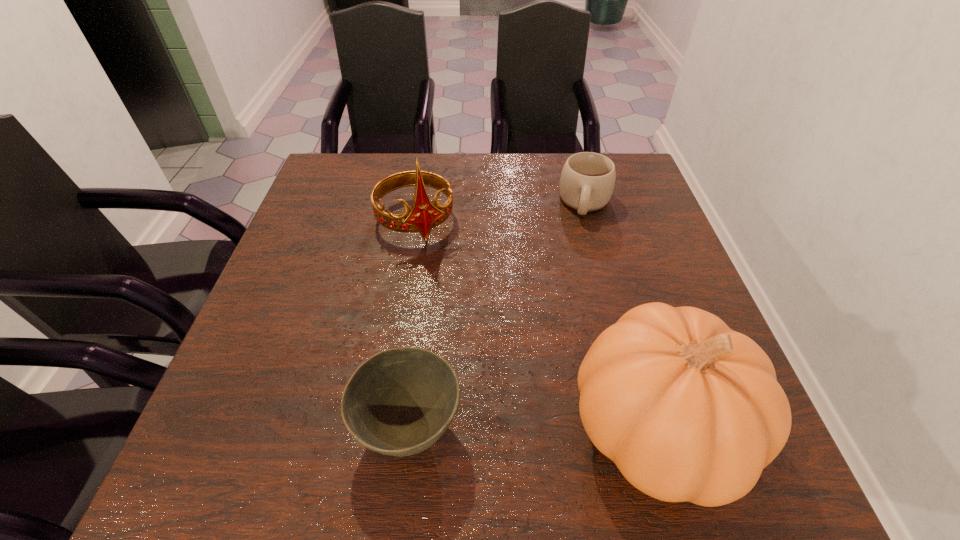
In the image, there is a desktop. Where is `vacant space at the far edge`? The image size is (960, 540). vacant space at the far edge is located at coordinates (487, 163).

Image resolution: width=960 pixels, height=540 pixels. Identify the location of free region at the left edge of the desktop. (314, 269).

In the image, there is a desktop. Identify the location of vacant space at the right edge. This screenshot has height=540, width=960. (647, 255).

Where is `vacant space at the far left corner of the desktop`? The width and height of the screenshot is (960, 540). vacant space at the far left corner of the desktop is located at coordinates (309, 197).

Locate an element on the screen. The width and height of the screenshot is (960, 540). blank space at the far right corner is located at coordinates (627, 156).

Find the location of a particular element. vacant area that lies between the tiara and the pumpkin is located at coordinates (537, 325).

Find the location of `unoccupied position between the bowl and the tiara`. unoccupied position between the bowl and the tiara is located at coordinates (413, 325).

At what (x,y) coordinates should I click in order to perform the action: click on free space between the tiara and the mug. Please return your answer as a coordinate pair (x, y). This screenshot has height=540, width=960. Looking at the image, I should click on (500, 212).

Find the location of a particular element. The height and width of the screenshot is (540, 960). free space that is in between the mug and the bowl is located at coordinates (497, 315).

Where is `unoccupied area between the bowl and the pumpkin`? This screenshot has width=960, height=540. unoccupied area between the bowl and the pumpkin is located at coordinates (533, 429).